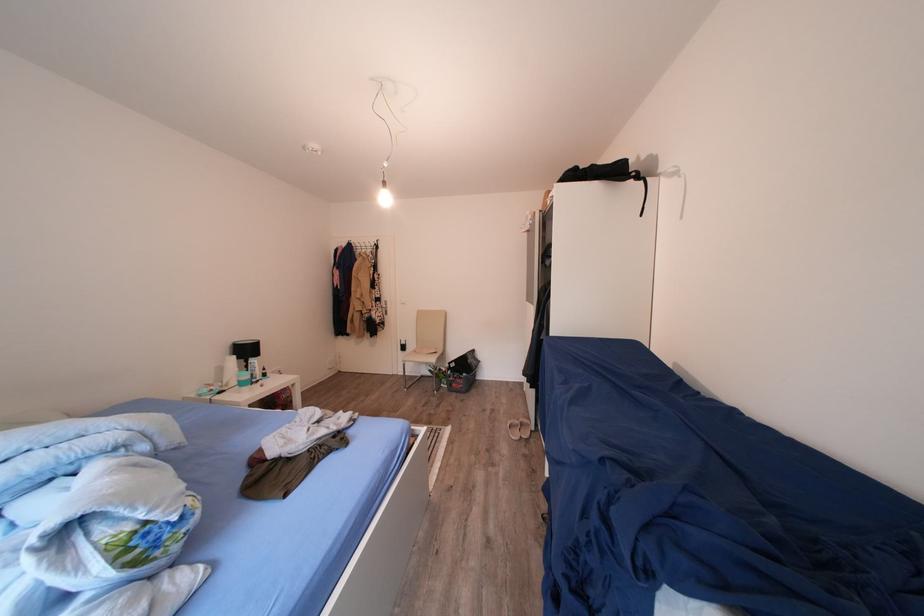
What are the coordinates of `white plastic bottle` in the screenshot? It's located at (253, 369).